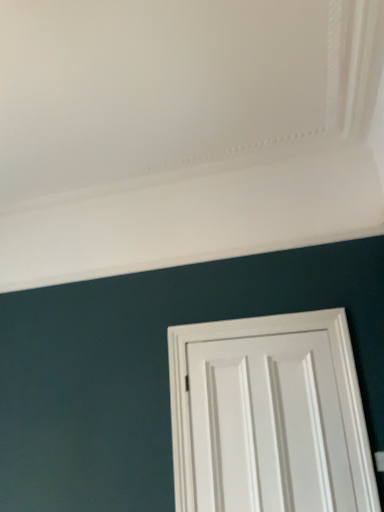
In order to face white matte door at center, should I rotate leftwards or rightwards?

Turn right by 9.244 degrees to look at white matte door at center.

Where is `white matte door at center`? Image resolution: width=384 pixels, height=512 pixels. white matte door at center is located at coordinates (269, 416).

The height and width of the screenshot is (512, 384). Describe the element at coordinates (269, 416) in the screenshot. I see `white matte door at center` at that location.

Where is `white matte door at center`? The height and width of the screenshot is (512, 384). white matte door at center is located at coordinates (269, 416).